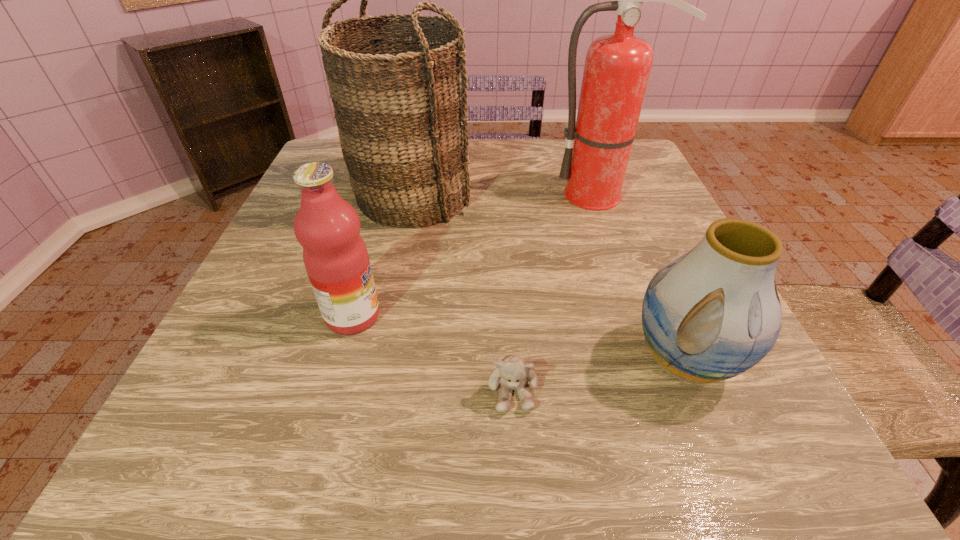
Locate an element on the screen. This screenshot has width=960, height=540. vacant area that lies between the fruit juice and the vase is located at coordinates (518, 338).

You are a GUI agent. You are given a task and a screenshot of the screen. Output one action in this format:
    pyautogui.click(x=<x>, y=<y>)
    Task: Click on the unoccupied area between the shortest object and the fruit juice
    The image size is (960, 540).
    Given the screenshot: What is the action you would take?
    pyautogui.click(x=433, y=353)

You are a GUI agent. You are given a task and a screenshot of the screen. Output one action in this format:
    pyautogui.click(x=<x>, y=<y>)
    Task: Click on the free space between the fire extinguisher and the fourth tallest object
    
    Given the screenshot: What is the action you would take?
    pyautogui.click(x=642, y=277)

Locate an element on the screen. Image resolution: width=960 pixels, height=540 pixels. the second closest object to the fruit juice is located at coordinates (511, 373).

Identify which object is the closest to the basket. Please provide its 2D coordinates. Your answer should be formatted as a tuple, i.e. [(x, y)], where the tuple contains the x and y coordinates of a point satisfying the conditions above.

[(617, 67)]

Where is `free location that satisfies the following two spatial constraints: 1. on the back side of the second shortest object; 2. on the label of the fruit juice`? The image size is (960, 540). free location that satisfies the following two spatial constraints: 1. on the back side of the second shortest object; 2. on the label of the fruit juice is located at coordinates (666, 316).

The width and height of the screenshot is (960, 540). I want to click on free location that satisfies the following two spatial constraints: 1. with the handle and hose on the fire extinguisher; 2. on the left side of the vase, so click(x=660, y=360).

I want to click on vacant space that satisfies the following two spatial constraints: 1. on the front side of the basket; 2. on the label of the fruit juice, so click(x=388, y=316).

Identify the location of blank area in the image that satisfies the following two spatial constraints: 1. with the handle and hose on the fire extinguisher; 2. on the right side of the fourth tallest object. (660, 360).

You are a GUI agent. You are given a task and a screenshot of the screen. Output one action in this format:
    pyautogui.click(x=<x>, y=<y>)
    Task: Click on the blank space that satisfies the following two spatial constraints: 1. on the label of the vase; 2. on the left side of the fruit juice
    This screenshot has width=960, height=540.
    Given the screenshot: What is the action you would take?
    pyautogui.click(x=341, y=360)